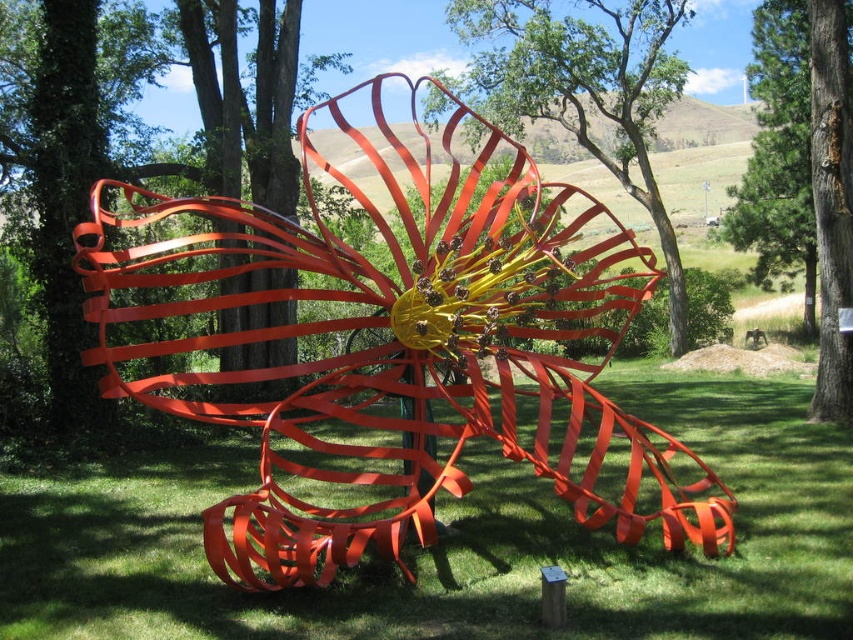
You are standing at the center of the grassy area and want to place a new decorative flag exactly at the same 2D location as the metallic red ribbon at center. What are the coordinates where you should place the flag?

The coordinates for the metallic red ribbon at center are at point (402, 353), so you should place the flag at the same coordinates, 0.552 and 0.472.

You are an artist planning to paint a landscape that includes the metallic red ribbon at center and the glossy orange sculpture at center. Which object should you paint first if you want to follow the rule of painting taller objects before shorter ones?

The metallic red ribbon at center is taller than the glossy orange sculpture at center, so you should paint the metallic red ribbon at center first.